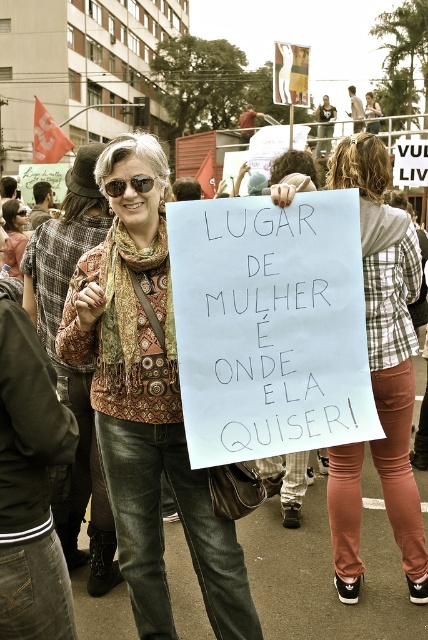
You are a photographer trying to capture a photo of the plaid shirt at center and the brown leather jacket at center in the protest scene. Which object should you focus on first if you want to ensure both are in frame without moving the camera?

You should focus on the brown leather jacket at center first because it occupies more space than the plaid shirt at center, making it easier to frame both objects without moving the camera.